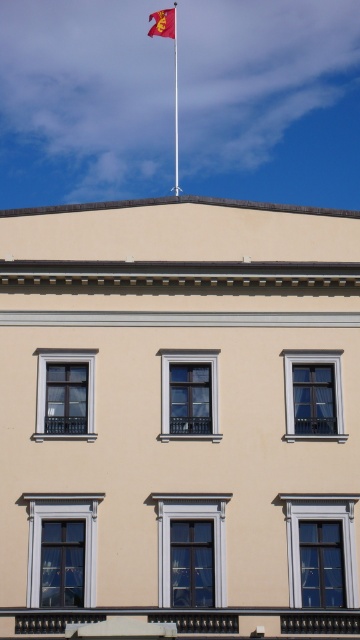
Question: Does red fabric flag at upper center appear on the right side of red fabric flagpole at upper center?

Choices:
 (A) no
 (B) yes

Answer: (A)

Question: Does red fabric flag at upper center appear on the right side of red fabric flagpole at upper center?

Choices:
 (A) no
 (B) yes

Answer: (A)

Question: Does red fabric flag at upper center have a smaller size compared to red fabric flagpole at upper center?

Choices:
 (A) no
 (B) yes

Answer: (A)

Question: Which object is farther from the camera taking this photo?

Choices:
 (A) red fabric flagpole at upper center
 (B) red fabric flag at upper center

Answer: (A)

Question: Which point is closer to the camera?

Choices:
 (A) (177, 68)
 (B) (173, 20)

Answer: (B)